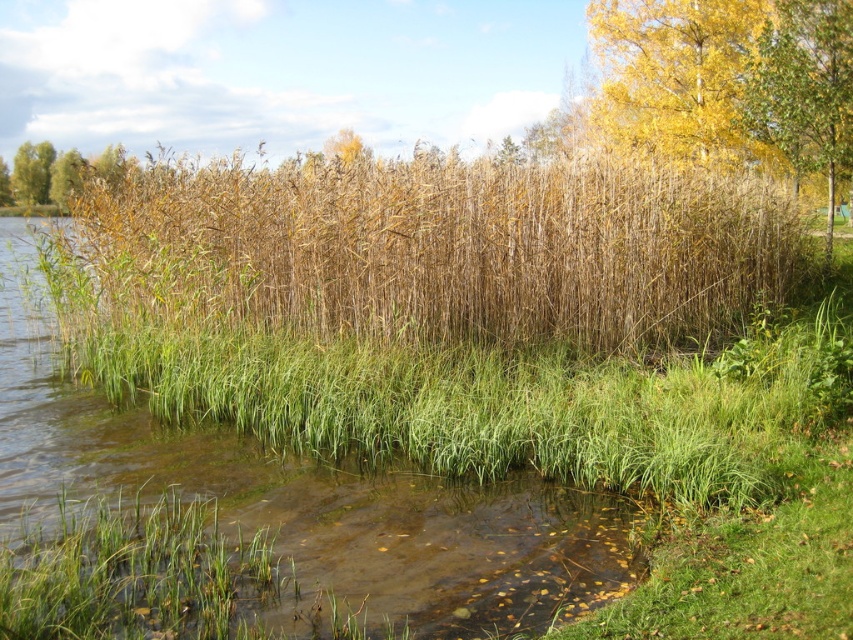
Can you confirm if yellow leafy tree at upper right is thinner than green leafy tree at upper right?

No, yellow leafy tree at upper right is not thinner than green leafy tree at upper right.

Is the position of yellow leafy tree at upper right less distant than that of green leafy tree at upper right?

No, it is not.

Is point (670, 150) positioned after point (843, 81)?

Yes.

Find the location of a particular element. yellow leafy tree at upper right is located at coordinates (677, 77).

Which is behind, point (733, 179) or point (602, 108)?

Point (602, 108)

Is point (581, 333) closer to camera compared to point (627, 102)?

Yes, it is.

The height and width of the screenshot is (640, 853). What are the coordinates of `dry grass at center` in the screenshot? It's located at (444, 250).

Does yellow leafy tree at upper right have a greater height compared to green grass at left?

Correct, yellow leafy tree at upper right is much taller as green grass at left.

Is point (703, 67) in front of point (64, 202)?

Yes, it is in front of point (64, 202).

Locate an element on the screen. Image resolution: width=853 pixels, height=640 pixels. yellow leafy tree at upper right is located at coordinates (677, 77).